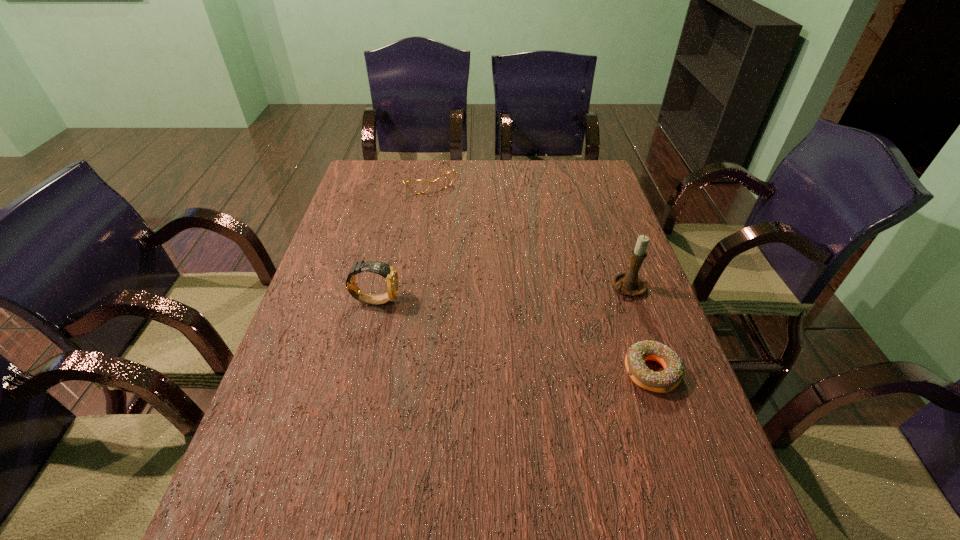
This screenshot has width=960, height=540. Find the location of `watch`. watch is located at coordinates (388, 272).

You are a GUI agent. You are given a task and a screenshot of the screen. Output one action in this format:
    pyautogui.click(x=<x>, y=<y>)
    Task: Click on the nearest object
    The height and width of the screenshot is (540, 960).
    Given the screenshot: What is the action you would take?
    pyautogui.click(x=667, y=380)

This screenshot has width=960, height=540. I want to click on the shortest object, so click(667, 380).

At what (x,y) coordinates should I click in order to perform the action: click on the farthest object. Please return your answer as a coordinate pair (x, y). The height and width of the screenshot is (540, 960). Looking at the image, I should click on (416, 186).

Image resolution: width=960 pixels, height=540 pixels. What are the coordinates of `the third tallest object` in the screenshot? It's located at (416, 186).

The height and width of the screenshot is (540, 960). I want to click on the tallest object, so click(x=628, y=282).

Locate an element on the screen. The height and width of the screenshot is (540, 960). free region located 0.130m on the face of the watch is located at coordinates (449, 300).

You are a GUI agent. You are given a task and a screenshot of the screen. Output one action in this format:
    pyautogui.click(x=<x>, y=<y>)
    Task: Click on the free space located 0.280m on the back of the doughnut
    
    Given the screenshot: What is the action you would take?
    pyautogui.click(x=617, y=269)

Where is `free spot located 0.380m on the front-facing side of the second shortest object`? This screenshot has height=540, width=960. free spot located 0.380m on the front-facing side of the second shortest object is located at coordinates (483, 260).

What are the coordinates of `vacant area situated 0.350m on the front-facing side of the second shortest object` in the screenshot? It's located at (478, 254).